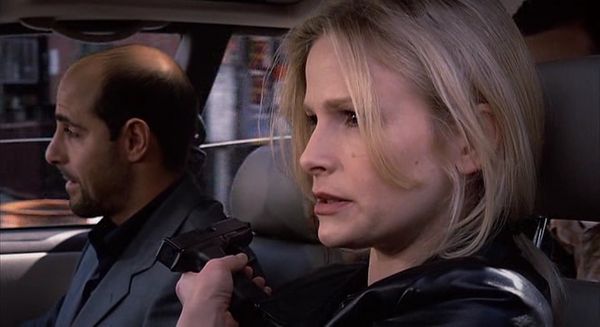
Find the location of a particular element. headrest is located at coordinates (251, 191), (573, 148).